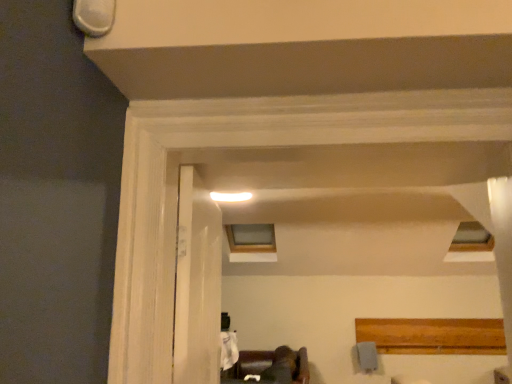
Question: Is clear glass window at upper center taller than white wood door at center?

Choices:
 (A) yes
 (B) no

Answer: (B)

Question: Is clear glass window at upper center next to white wood door at center?

Choices:
 (A) yes
 (B) no

Answer: (B)

Question: Is clear glass window at upper center closer to the viewer compared to white wood door at center?

Choices:
 (A) yes
 (B) no

Answer: (B)

Question: Is white wood door at center at the back of clear glass window at upper center?

Choices:
 (A) no
 (B) yes

Answer: (A)

Question: Is clear glass window at upper center shorter than white wood door at center?

Choices:
 (A) no
 (B) yes

Answer: (B)

Question: From a real-world perspective, is white wood door at center above or below dark brown leather couch at lower center?

Choices:
 (A) below
 (B) above

Answer: (B)

Question: From the image's perspective, is white wood door at center positioned above or below dark brown leather couch at lower center?

Choices:
 (A) below
 (B) above

Answer: (B)

Question: From their relative heights in the image, would you say white wood door at center is taller or shorter than dark brown leather couch at lower center?

Choices:
 (A) short
 (B) tall

Answer: (B)

Question: Considering the positions of point click(x=219, y=347) and point click(x=273, y=357), is point click(x=219, y=347) closer or farther from the camera than point click(x=273, y=357)?

Choices:
 (A) closer
 (B) farther

Answer: (A)

Question: Considering the positions of point [229, 243] and point [219, 304], is point [229, 243] closer or farther from the camera than point [219, 304]?

Choices:
 (A) closer
 (B) farther

Answer: (B)

Question: In terms of height, does clear glass window at upper center look taller or shorter compared to white wood door at center?

Choices:
 (A) short
 (B) tall

Answer: (A)

Question: Which is correct: clear glass window at upper center is inside white wood door at center, or outside of it?

Choices:
 (A) outside
 (B) inside

Answer: (A)

Question: From the image's perspective, relative to white wood door at center, is clear glass window at upper center above or below?

Choices:
 (A) below
 (B) above

Answer: (A)

Question: In the image, is clear glass window at upper center positioned in front of or behind dark brown leather couch at lower center?

Choices:
 (A) front
 (B) behind

Answer: (B)

Question: Looking at the image, does clear glass window at upper center seem bigger or smaller compared to dark brown leather couch at lower center?

Choices:
 (A) big
 (B) small

Answer: (A)